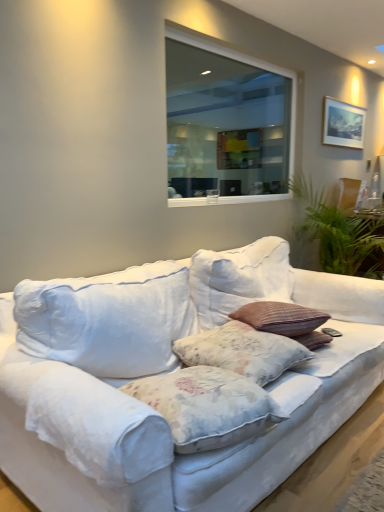
Image resolution: width=384 pixels, height=512 pixels. What do you see at coordinates (337, 230) in the screenshot?
I see `green leafy plant at right` at bounding box center [337, 230].

Describe the element at coordinates (226, 122) in the screenshot. The image size is (384, 512). I see `transparent glass window at upper center` at that location.

Where is `white fabric couch at center`? The width and height of the screenshot is (384, 512). white fabric couch at center is located at coordinates (167, 421).

Describe the element at coordinates (207, 406) in the screenshot. I see `floral fabric pillow at center, which ranks as the second pillow in back-to-front order` at that location.

Find the location of a particular element. The image size is (384, 512). green leafy plant at right is located at coordinates (337, 230).

Based on their sizes in the image, would you say white fabric couch at center is bigger or smaller than metallic silver picture frame at upper right?

Clearly, white fabric couch at center is larger in size than metallic silver picture frame at upper right.

Find the location of a particular element. The width and height of the screenshot is (384, 512). picture frame above the white fabric couch at center (from the image's perspective) is located at coordinates (342, 124).

From a real-world perspective, does white fabric couch at center stand above metallic silver picture frame at upper right?

No, from a real-world perspective, white fabric couch at center is not over metallic silver picture frame at upper right

Is white fabric couch at center inside or outside of metallic silver picture frame at upper right?

The correct answer is: outside.

How distant is green leafy plant at right from floral fabric pillow at center, which appears as the 1th pillow when viewed from the back?

The distance of green leafy plant at right from floral fabric pillow at center, which appears as the 1th pillow when viewed from the back, is 5.91 feet.

Who is bigger, green leafy plant at right or floral fabric pillow at center, the second pillow from the front?

green leafy plant at right is bigger.

From the picture: Is green leafy plant at right inside the boundaries of floral fabric pillow at center, the second pillow from the front, or outside?

Result: green leafy plant at right cannot be found inside floral fabric pillow at center, the second pillow from the front.

Are floral fabric pillow at center, which appears as the 1th pillow when viewed from the back, and transparent glass window at upper center making contact?

No, floral fabric pillow at center, which appears as the 1th pillow when viewed from the back, is not next to transparent glass window at upper center.

Consider the image. Could you measure the distance between floral fabric pillow at center, which appears as the 1th pillow when viewed from the back, and transparent glass window at upper center?

A distance of 9.34 feet exists between floral fabric pillow at center, which appears as the 1th pillow when viewed from the back, and transparent glass window at upper center.

Locate an element on the screen. This screenshot has height=512, width=384. the 1st pillow positioned below the transparent glass window at upper center (from a real-world perspective) is located at coordinates (242, 351).

Is white fabric couch at center taller or shorter than transparent glass window at upper center?

Considering their sizes, white fabric couch at center has less height than transparent glass window at upper center.

From the image's perspective, who appears lower, white fabric couch at center or transparent glass window at upper center?

white fabric couch at center, from the image's perspective.

From a real-world perspective, does white fabric couch at center stand above transparent glass window at upper center?

No, from a real-world perspective, white fabric couch at center is not on top of transparent glass window at upper center.

Where is `studio couch on the left of the transparent glass window at upper center`? The height and width of the screenshot is (512, 384). studio couch on the left of the transparent glass window at upper center is located at coordinates (167, 421).

Does metallic silver picture frame at upper right have a larger size compared to floral fabric pillow at center, which ranks as the second pillow in back-to-front order?

Actually, metallic silver picture frame at upper right might be smaller than floral fabric pillow at center, which ranks as the second pillow in back-to-front order.

How much distance is there between metallic silver picture frame at upper right and floral fabric pillow at center, which ranks as the second pillow in back-to-front order?

metallic silver picture frame at upper right and floral fabric pillow at center, which ranks as the second pillow in back-to-front order, are 2.97 meters apart from each other.

Is metallic silver picture frame at upper right behind floral fabric pillow at center, which ranks as the second pillow in back-to-front order?

That is True.

Between floral fabric pillow at center, which appears as the 1th pillow when viewed from the back, and green leafy plant at right, which one has more height?

green leafy plant at right is taller.

Considering the points (296, 364) and (323, 238), which point is behind, point (296, 364) or point (323, 238)?

The point (323, 238) is more distant.

From the image's perspective, between floral fabric pillow at center, which appears as the 1th pillow when viewed from the back, and green leafy plant at right, which one is located above?

green leafy plant at right is shown above in the image.

At what (x,y) coordinates should I click in order to perform the action: click on pillow that is the 1st one when counting leftward from the green leafy plant at right. Please return your answer as a coordinate pair (x, y). The height and width of the screenshot is (512, 384). Looking at the image, I should click on (242, 351).

Considering their positions, is green leafy plant at right located in front of or behind floral fabric pillow at center, arranged as the first pillow when viewed from the front?

Clearly, green leafy plant at right is behind floral fabric pillow at center, arranged as the first pillow when viewed from the front.

From a real-world perspective, relative to floral fabric pillow at center, which ranks as the second pillow in back-to-front order, is green leafy plant at right vertically above or below?

green leafy plant at right is situated higher than floral fabric pillow at center, which ranks as the second pillow in back-to-front order, in the real world.

Is green leafy plant at right next to floral fabric pillow at center, which ranks as the second pillow in back-to-front order?

No, green leafy plant at right is not making contact with floral fabric pillow at center, which ranks as the second pillow in back-to-front order.

Which of these two, green leafy plant at right or floral fabric pillow at center, which ranks as the second pillow in back-to-front order, stands taller?

With more height is green leafy plant at right.

Find the location of a particular element. The width and height of the screenshot is (384, 512). picture frame above the white fabric couch at center (from a real-world perspective) is located at coordinates (342, 124).

The image size is (384, 512). There is a green leafy plant at right. Identify the location of the 1st pillow below it (from a real-world perspective). (242, 351).

From the image, which object appears to be nearer to white fabric couch at center, transparent glass window at upper center or green leafy plant at right?

green leafy plant at right is closer to white fabric couch at center.

Considering their positions, is floral fabric pillow at center, which appears as the 1th pillow when viewed from the back, positioned further to white fabric couch at center than metallic silver picture frame at upper right?

metallic silver picture frame at upper right lies further to white fabric couch at center than the other object.

From the image, which object appears to be nearer to floral fabric pillow at center, which appears as the 1th pillow when viewed from the back, white fabric couch at center or floral fabric pillow at center, arranged as the first pillow when viewed from the front?

Based on the image, floral fabric pillow at center, arranged as the first pillow when viewed from the front, appears to be nearer to floral fabric pillow at center, which appears as the 1th pillow when viewed from the back.

Which object lies further to the anchor point transparent glass window at upper center, floral fabric pillow at center, which ranks as the second pillow in back-to-front order, or metallic silver picture frame at upper right?

floral fabric pillow at center, which ranks as the second pillow in back-to-front order, is further to transparent glass window at upper center.

Looking at the image, which one is located further to floral fabric pillow at center, arranged as the first pillow when viewed from the front, white fabric couch at center or metallic silver picture frame at upper right?

metallic silver picture frame at upper right is further to floral fabric pillow at center, arranged as the first pillow when viewed from the front.

Looking at the image, which one is located further to green leafy plant at right, metallic silver picture frame at upper right or transparent glass window at upper center?

transparent glass window at upper center is positioned further to the anchor green leafy plant at right.

From the image, which object appears to be farther from transparent glass window at upper center, floral fabric pillow at center, which appears as the 1th pillow when viewed from the back, or green leafy plant at right?

Among the two, floral fabric pillow at center, which appears as the 1th pillow when viewed from the back, is located further to transparent glass window at upper center.

From the image, which object appears to be farther from transparent glass window at upper center, white fabric couch at center or floral fabric pillow at center, which appears as the 1th pillow when viewed from the back?

floral fabric pillow at center, which appears as the 1th pillow when viewed from the back, lies further to transparent glass window at upper center than the other object.

Locate an element on the screen. The height and width of the screenshot is (512, 384). window located between floral fabric pillow at center, arranged as the first pillow when viewed from the front, and green leafy plant at right in the depth direction is located at coordinates (226, 122).

This screenshot has height=512, width=384. I want to click on pillow between transparent glass window at upper center and white fabric couch at center in the up-down direction, so click(x=242, y=351).

Where is `window between floral fabric pillow at center, arranged as the first pillow when viewed from the front, and metallic silver picture frame at upper right from front to back`? The height and width of the screenshot is (512, 384). window between floral fabric pillow at center, arranged as the first pillow when viewed from the front, and metallic silver picture frame at upper right from front to back is located at coordinates 226,122.

Image resolution: width=384 pixels, height=512 pixels. Find the location of `window between white fabric couch at center and metallic silver picture frame at upper right in the front-back direction`. window between white fabric couch at center and metallic silver picture frame at upper right in the front-back direction is located at coordinates (226, 122).